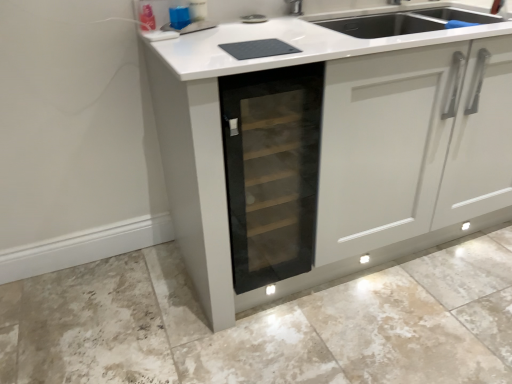
Where is `transparent glass wine cooler at center`? The height and width of the screenshot is (384, 512). transparent glass wine cooler at center is located at coordinates (272, 171).

What do you see at coordinates (272, 171) in the screenshot? I see `transparent glass wine cooler at center` at bounding box center [272, 171].

This screenshot has height=384, width=512. Describe the element at coordinates (267, 324) in the screenshot. I see `matte gray granite at lower center` at that location.

Where is `matte gray granite at lower center`? This screenshot has height=384, width=512. matte gray granite at lower center is located at coordinates (267, 324).

Where is `transparent glass wine cooler at center`? The height and width of the screenshot is (384, 512). transparent glass wine cooler at center is located at coordinates (272, 171).

Does transparent glass wine cooler at center appear on the right side of matte gray granite at lower center?

Incorrect, transparent glass wine cooler at center is not on the right side of matte gray granite at lower center.

Which object is further away from the camera, transparent glass wine cooler at center or matte gray granite at lower center?

transparent glass wine cooler at center is behind.

Which is behind, point (305, 148) or point (386, 306)?

Positioned behind is point (386, 306).

From the picture: From the image's perspective, is transparent glass wine cooler at center above or below matte gray granite at lower center?

Based on their image positions, transparent glass wine cooler at center is located above matte gray granite at lower center.

From a real-world perspective, is transparent glass wine cooler at center physically located above or below matte gray granite at lower center?

transparent glass wine cooler at center is above matte gray granite at lower center.

Which object is wider, transparent glass wine cooler at center or matte gray granite at lower center?

Wider between the two is matte gray granite at lower center.

In terms of height, does transparent glass wine cooler at center look taller or shorter compared to matte gray granite at lower center?

In the image, transparent glass wine cooler at center appears to be taller than matte gray granite at lower center.

Is transparent glass wine cooler at center bigger or smaller than matte gray granite at lower center?

Clearly, transparent glass wine cooler at center is smaller in size than matte gray granite at lower center.

Is transparent glass wine cooler at center inside the boundaries of matte gray granite at lower center, or outside?

transparent glass wine cooler at center is located beyond the bounds of matte gray granite at lower center.

Can you see transparent glass wine cooler at center touching matte gray granite at lower center?

There is a gap between transparent glass wine cooler at center and matte gray granite at lower center.

Is transparent glass wine cooler at center looking in the opposite direction of matte gray granite at lower center?

No, transparent glass wine cooler at center is not facing the opposite direction of matte gray granite at lower center.

What's the angular difference between transparent glass wine cooler at center and matte gray granite at lower center's facing directions?

89.9 degrees.

Locate an element on the screen. The height and width of the screenshot is (384, 512). granite to the right of transparent glass wine cooler at center is located at coordinates (267, 324).

Visually, is matte gray granite at lower center positioned to the left or to the right of transparent glass wine cooler at center?

matte gray granite at lower center is to the right of transparent glass wine cooler at center.

Which is behind, matte gray granite at lower center or transparent glass wine cooler at center?

Positioned behind is transparent glass wine cooler at center.

Considering the positions of point (420, 264) and point (311, 70), is point (420, 264) closer or farther from the camera than point (311, 70)?

Point (420, 264).

From the image's perspective, is matte gray granite at lower center positioned above or below transparent glass wine cooler at center?

matte gray granite at lower center is below transparent glass wine cooler at center.

From a real-world perspective, is matte gray granite at lower center located higher than transparent glass wine cooler at center?

No.

Is matte gray granite at lower center wider than transparent glass wine cooler at center?

Yes.

Who is shorter, matte gray granite at lower center or transparent glass wine cooler at center?

matte gray granite at lower center.

In the scene shown: Can you confirm if matte gray granite at lower center is smaller than transparent glass wine cooler at center?

Incorrect, matte gray granite at lower center is not smaller in size than transparent glass wine cooler at center.

Is transparent glass wine cooler at center completely or partially inside matte gray granite at lower center?

Actually, transparent glass wine cooler at center is outside matte gray granite at lower center.

Are matte gray granite at lower center and transparent glass wine cooler at center making contact?

matte gray granite at lower center is not next to transparent glass wine cooler at center, and they're not touching.

Is matte gray granite at lower center aimed at transparent glass wine cooler at center?

No, matte gray granite at lower center is not oriented towards transparent glass wine cooler at center.

What's the angular difference between matte gray granite at lower center and transparent glass wine cooler at center's facing directions?

89.9 degrees separate the facing orientations of matte gray granite at lower center and transparent glass wine cooler at center.

Where is `granite that is in front of the transparent glass wine cooler at center`? The height and width of the screenshot is (384, 512). granite that is in front of the transparent glass wine cooler at center is located at coordinates (267, 324).

Image resolution: width=512 pixels, height=384 pixels. In order to click on oven above the matte gray granite at lower center (from a real-world perspective) in this screenshot , I will do `click(272, 171)`.

At what (x,y) coordinates should I click in order to perform the action: click on oven lying behind the matte gray granite at lower center. Please return your answer as a coordinate pair (x, y). Looking at the image, I should click on (272, 171).